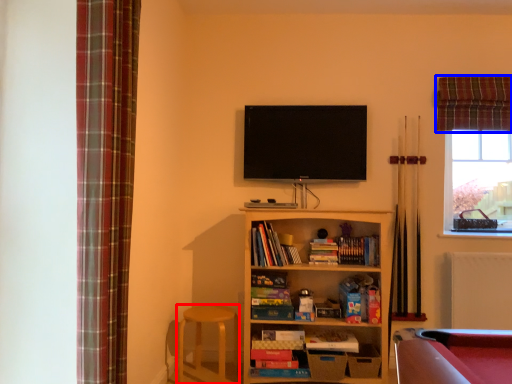
Question: Among these objects, which one is farthest to the camera, bar stool (highlighted by a red box) or curtain (highlighted by a blue box)?

Choices:
 (A) bar stool
 (B) curtain

Answer: (B)